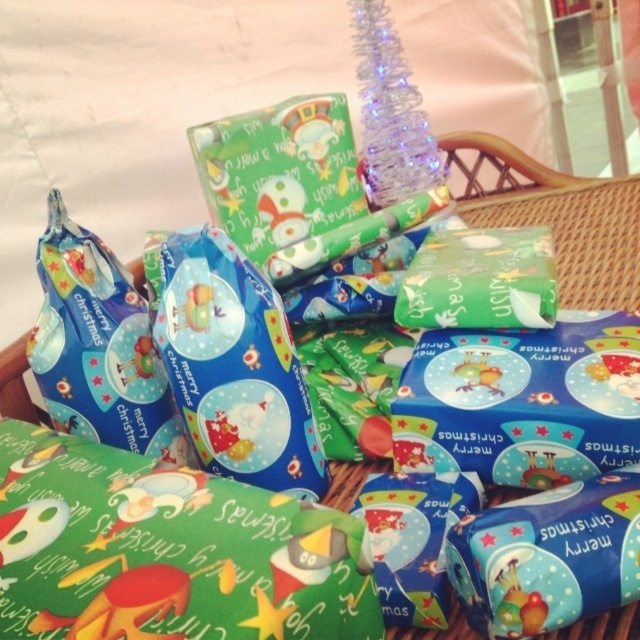
Question: Which object is closer to the camera taking this photo?

Choices:
 (A) green paper gift at center
 (B) blue glossy gift bag at center
 (C) blue glossy gift bag at left

Answer: (B)

Question: Can you confirm if green shiny wrapping paper at lower left is bigger than blue glossy gift bag at center?

Choices:
 (A) yes
 (B) no

Answer: (B)

Question: Is green shiny wrapping paper at lower left bigger than blue glossy gift bag at center?

Choices:
 (A) no
 (B) yes

Answer: (A)

Question: Is green shiny wrapping paper at lower left positioned in front of green paper gift at center?

Choices:
 (A) no
 (B) yes

Answer: (B)

Question: Among these points, which one is nearest to the camera?

Choices:
 (A) (x=77, y=404)
 (B) (x=113, y=452)
 (C) (x=557, y=180)

Answer: (B)

Question: Among these objects, which one is nearest to the camera?

Choices:
 (A) green shiny wrapping paper at lower left
 (B) green paper gift at center
 (C) blue glossy gift bag at center
 (D) blue glossy gift bag at left

Answer: (A)